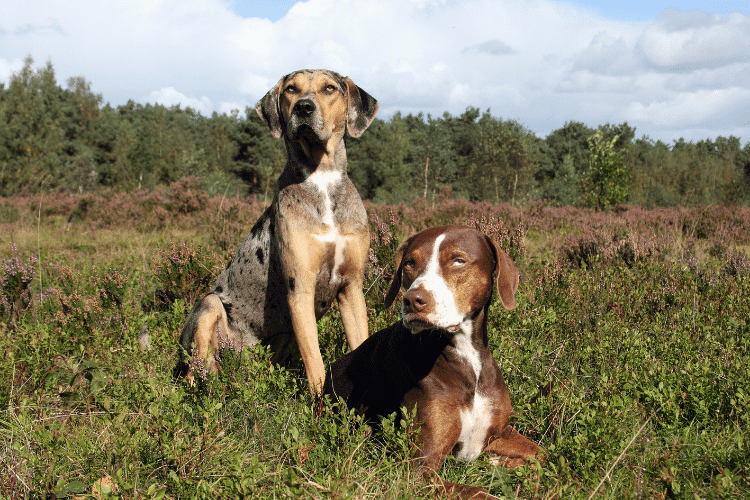
Find the location of a particular element. The width and height of the screenshot is (750, 500). chest is located at coordinates (328, 228), (462, 406).